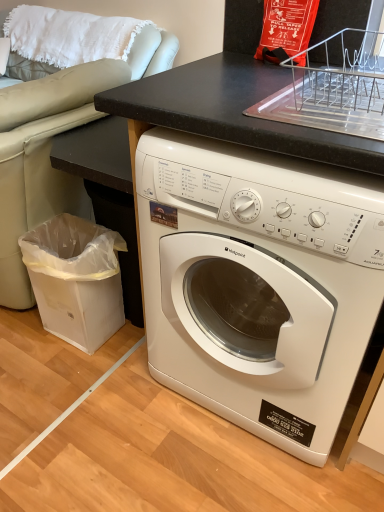
Find the location of a particular element. The image size is (384, 512). empty space that is ontop of white glossy washing machine at center is located at coordinates (244, 91).